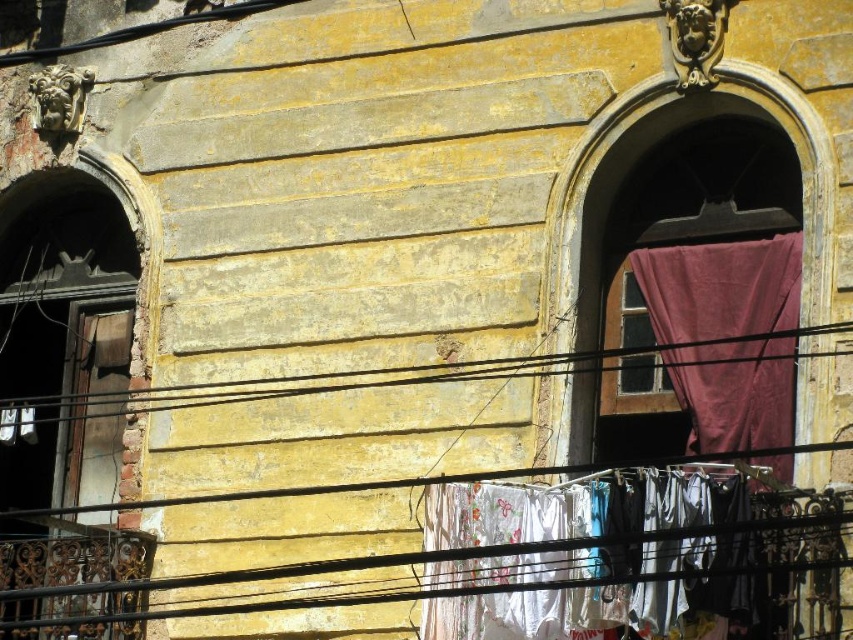
Question: In this image, where is white fabric laundry at center located relative to purple fabric curtain at right?

Choices:
 (A) above
 (B) below

Answer: (B)

Question: Which of the following is the closest to the observer?

Choices:
 (A) (770, 332)
 (B) (558, 490)

Answer: (B)

Question: Is white fabric laundry at center in front of purple fabric curtain at right?

Choices:
 (A) yes
 (B) no

Answer: (A)

Question: Among these points, which one is nearest to the camera?

Choices:
 (A) (699, 301)
 (B) (555, 579)

Answer: (B)

Question: Does white fabric laundry at center have a greater width compared to purple fabric curtain at right?

Choices:
 (A) no
 (B) yes

Answer: (A)